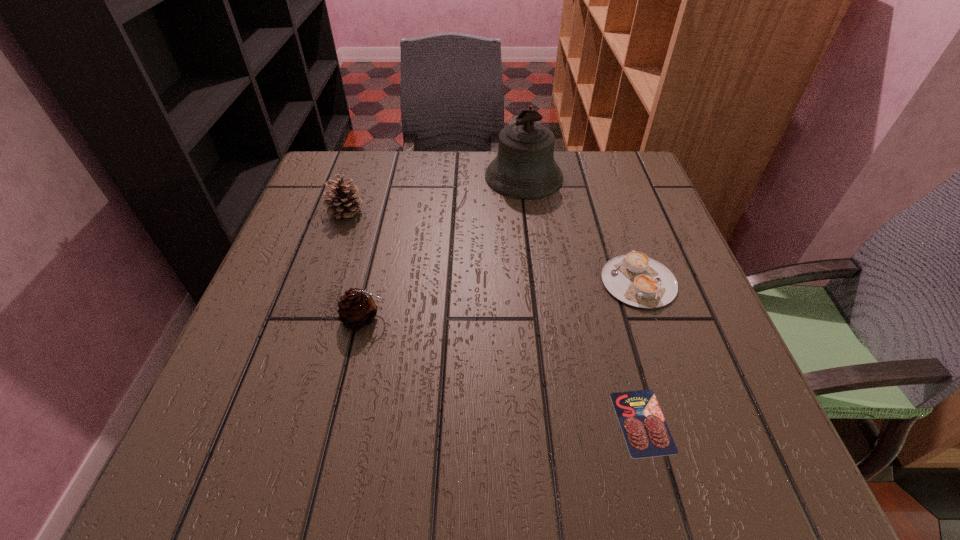
I want to click on object that is at the far left corner, so point(341,203).

At what (x,y) coordinates should I click in order to perform the action: click on object that is positioned at the near right corner. Please return your answer as a coordinate pair (x, y). Image resolution: width=960 pixels, height=540 pixels. Looking at the image, I should click on (646, 433).

The width and height of the screenshot is (960, 540). What are the coordinates of `free space at the far edge` in the screenshot? It's located at (406, 156).

I want to click on vacant space at the near edge of the desktop, so click(545, 434).

Find the location of `vacant point at the left edge`. vacant point at the left edge is located at coordinates (322, 356).

Where is `free location at the right edge of the desktop`? The height and width of the screenshot is (540, 960). free location at the right edge of the desktop is located at coordinates (669, 221).

You are a GUI agent. You are given a task and a screenshot of the screen. Output one action in this format:
    pyautogui.click(x=<x>, y=<y>)
    Task: Click on the vacant space at the far left corner
    Image resolution: width=960 pixels, height=540 pixels.
    Given the screenshot: What is the action you would take?
    pyautogui.click(x=337, y=173)

Locate an element on the screen. Image resolution: width=960 pixels, height=540 pixels. blank space at the near left corner is located at coordinates (261, 489).

You are a GUI agent. You are given a task and a screenshot of the screen. Output one action in this format:
    pyautogui.click(x=<x>, y=<y>)
    Task: Click on the free space at the far right corner
    The width and height of the screenshot is (960, 540).
    Given the screenshot: What is the action you would take?
    pyautogui.click(x=646, y=194)

Where is `free space that is in between the nearer pinecone and the tallest object`? The width and height of the screenshot is (960, 540). free space that is in between the nearer pinecone and the tallest object is located at coordinates pyautogui.click(x=444, y=247).